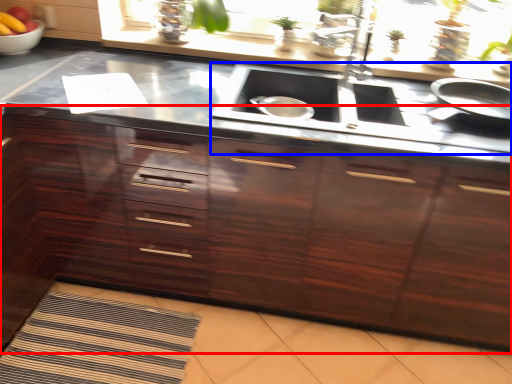
Question: Which point is further to the camera, cabinetry (highlighted by a red box) or stove (highlighted by a blue box)?

Choices:
 (A) cabinetry
 (B) stove

Answer: (B)